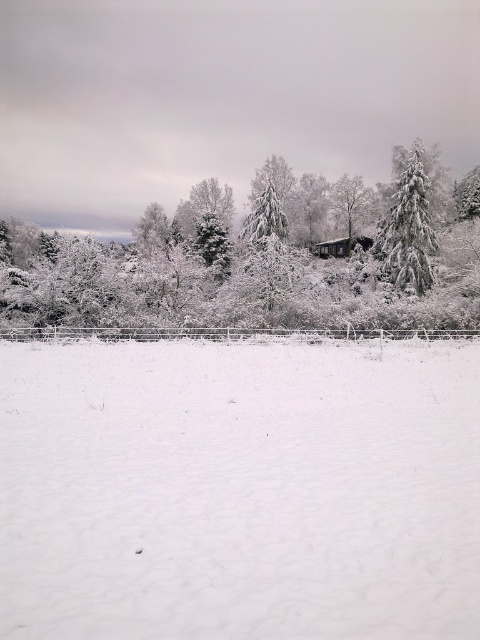
Can you confirm if white fluffy snow at center is taller than snow-covered evergreen at right?

In fact, white fluffy snow at center may be shorter than snow-covered evergreen at right.

Can you confirm if white fluffy snow at center is positioned below snow-covered evergreen at right?

Yes, white fluffy snow at center is below snow-covered evergreen at right.

Does point (402, 614) come behind point (408, 268)?

No, (402, 614) is in front of (408, 268).

Find the location of a particular element. Image resolution: width=480 pixels, height=640 pixels. white fluffy snow at center is located at coordinates (240, 490).

Is white frosty tree at upper center wider than snow-covered evergreen at right?

Yes.

What do you see at coordinates (264, 260) in the screenshot? This screenshot has height=640, width=480. I see `white frosty tree at upper center` at bounding box center [264, 260].

Image resolution: width=480 pixels, height=640 pixels. What do you see at coordinates (264, 260) in the screenshot? I see `white frosty tree at upper center` at bounding box center [264, 260].

This screenshot has height=640, width=480. Identify the location of white frosty tree at upper center. (264, 260).

Is white fluffy snow at center further to the viewer compared to white frosty tree at upper center?

No, it is not.

The height and width of the screenshot is (640, 480). Describe the element at coordinates (240, 490) in the screenshot. I see `white fluffy snow at center` at that location.

Where is `white fluffy snow at center`? white fluffy snow at center is located at coordinates (240, 490).